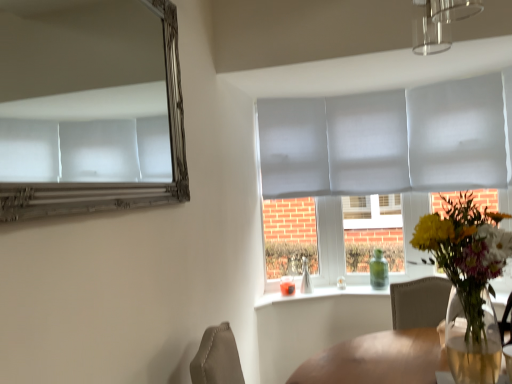
Where is `translucent glass vase at center`? translucent glass vase at center is located at coordinates (468, 282).

At what (x,y) coordinates should I click in order to perform the action: click on silver metallic mirror at upper left. Please return your answer as a coordinate pair (x, y). The width and height of the screenshot is (512, 384). Looking at the image, I should click on (116, 184).

The width and height of the screenshot is (512, 384). What do you see at coordinates (378, 270) in the screenshot?
I see `green glass bottle at window` at bounding box center [378, 270].

What is the approximate width of matte gray glass door at center?

The width of matte gray glass door at center is 5.38 inches.

In order to click on translucent glass vase at center in this screenshot , I will do `click(468, 282)`.

Is translucent glass vase at center oriented towards silver metallic mirror at upper left?

No.

Is translucent glass vase at center at the right side of silver metallic mirror at upper left?

Yes, translucent glass vase at center is to the right of silver metallic mirror at upper left.

From the image's perspective, is translucent glass vase at center above silver metallic mirror at upper left?

No, from the image's perspective, translucent glass vase at center is not above silver metallic mirror at upper left.

Considering the relative positions of translucent glass vase at center and silver metallic mirror at upper left in the image provided, is translucent glass vase at center behind silver metallic mirror at upper left?

Yes, translucent glass vase at center is further from the camera.

In terms of height, does green glass bottle at window look taller or shorter compared to translucent glass vase at center?

green glass bottle at window is shorter than translucent glass vase at center.

Does point (387, 262) come closer to viewer compared to point (446, 236)?

No, (387, 262) is further to viewer.

From the image's perspective, is green glass bottle at window below translucent glass vase at center?

Yes, from the image's perspective, green glass bottle at window is below translucent glass vase at center.

Is green glass bottle at window aimed at translucent glass vase at center?

Yes, green glass bottle at window is facing translucent glass vase at center.

Is matte gray glass door at center oriented away from translucent glass vase at window?

No, translucent glass vase at window is not at the back of matte gray glass door at center.

Locate an element on the screen. glass door located on the right of translucent glass vase at window is located at coordinates (368, 143).

From the image's perspective, is matte gray glass door at center beneath translucent glass vase at window?

No, from the image's perspective, matte gray glass door at center is not beneath translucent glass vase at window.

Does point (362, 151) come behind point (306, 285)?

Yes, point (362, 151) is behind point (306, 285).

Which is behind, point (53, 191) or point (304, 282)?

The point (304, 282) is farther from the camera.

How much distance is there between silver metallic mirror at upper left and translucent glass vase at window?

silver metallic mirror at upper left is 5.41 feet away from translucent glass vase at window.

Would you say translucent glass vase at window is part of silver metallic mirror at upper left's contents?

No, silver metallic mirror at upper left does not contain translucent glass vase at window.

Is silver metallic mirror at upper left far from translucent glass vase at window?

Yes.

Would you say translucent glass vase at center is part of silver metallic mirror at upper left's contents?

No, silver metallic mirror at upper left does not contain translucent glass vase at center.

From a real-world perspective, is silver metallic mirror at upper left on top of translucent glass vase at center?

Yes, from a real-world perspective, silver metallic mirror at upper left is above translucent glass vase at center.

Find the location of `mirror in front of the translucent glass vase at center`. mirror in front of the translucent glass vase at center is located at coordinates (116, 184).

Does point (167, 47) come farther from viewer compared to point (461, 358)?

Yes.

Is point (309, 291) closer to camera compared to point (446, 246)?

No, it is not.

Could you tell me if translucent glass vase at window is turned towards translucent glass vase at center?

Yes, translucent glass vase at window is aimed at translucent glass vase at center.

Which object is closer to the camera taking this photo, translucent glass vase at window or translucent glass vase at center?

translucent glass vase at center.

Considering the relative sizes of translucent glass vase at window and translucent glass vase at center in the image provided, is translucent glass vase at window bigger than translucent glass vase at center?

Incorrect, translucent glass vase at window is not larger than translucent glass vase at center.

Looking at this image, could silver metallic mirror at upper left be considered to be inside matte gray glass door at center?

No, silver metallic mirror at upper left is not surrounded by matte gray glass door at center.

Is matte gray glass door at center taller or shorter than silver metallic mirror at upper left?

matte gray glass door at center is taller than silver metallic mirror at upper left.

What's the angular difference between matte gray glass door at center and silver metallic mirror at upper left's facing directions?

The angular difference between matte gray glass door at center and silver metallic mirror at upper left is 90.5 degrees.

From a real-world perspective, is matte gray glass door at center under silver metallic mirror at upper left?

Indeed, from a real-world perspective, matte gray glass door at center is positioned beneath silver metallic mirror at upper left.

The width and height of the screenshot is (512, 384). I want to click on mirror above the translucent glass vase at center (from a real-world perspective), so click(116, 184).

At what (x,y) coordinates should I click in order to perform the action: click on bottle that appears below the translucent glass vase at center (from the image's perspective). Please return your answer as a coordinate pair (x, y). Looking at the image, I should click on [x=378, y=270].

When comparing their distances from translucent glass vase at center, does silver metallic mirror at upper left or green glass bottle at window seem closer?

silver metallic mirror at upper left.

Looking at the image, which one is located further to matte gray glass door at center, translucent glass vase at window or translucent glass vase at center?

Based on the image, translucent glass vase at center appears to be further to matte gray glass door at center.

Looking at the image, which one is located further to silver metallic mirror at upper left, translucent glass vase at window or matte gray glass door at center?

translucent glass vase at window is positioned further to the anchor silver metallic mirror at upper left.

Estimate the real-world distances between objects in this image. Which object is further from silver metallic mirror at upper left, green glass bottle at window or translucent glass vase at center?

green glass bottle at window lies further to silver metallic mirror at upper left than the other object.

From the image, which object appears to be nearer to translucent glass vase at center, green glass bottle at window or translucent glass vase at window?

The object closer to translucent glass vase at center is green glass bottle at window.

Which object lies nearer to the anchor point matte gray glass door at center, translucent glass vase at center or silver metallic mirror at upper left?

translucent glass vase at center lies closer to matte gray glass door at center than the other object.

Which object lies further to the anchor point matte gray glass door at center, translucent glass vase at center or translucent glass vase at window?

The object further to matte gray glass door at center is translucent glass vase at center.

When comparing their distances from silver metallic mirror at upper left, does matte gray glass door at center or green glass bottle at window seem closer?

matte gray glass door at center is positioned closer to the anchor silver metallic mirror at upper left.

Where is `houseplant positioned between silver metallic mirror at upper left and translucent glass vase at window from near to far`? houseplant positioned between silver metallic mirror at upper left and translucent glass vase at window from near to far is located at coordinates (468, 282).

In order to click on vase between translucent glass vase at center and matte gray glass door at center from front to back in this screenshot , I will do `click(305, 278)`.

Locate an element on the screen. houseplant positioned between silver metallic mirror at upper left and green glass bottle at window from near to far is located at coordinates (468, 282).

Locate an element on the screen. This screenshot has width=512, height=384. vase between silver metallic mirror at upper left and green glass bottle at window in the front-back direction is located at coordinates (305, 278).